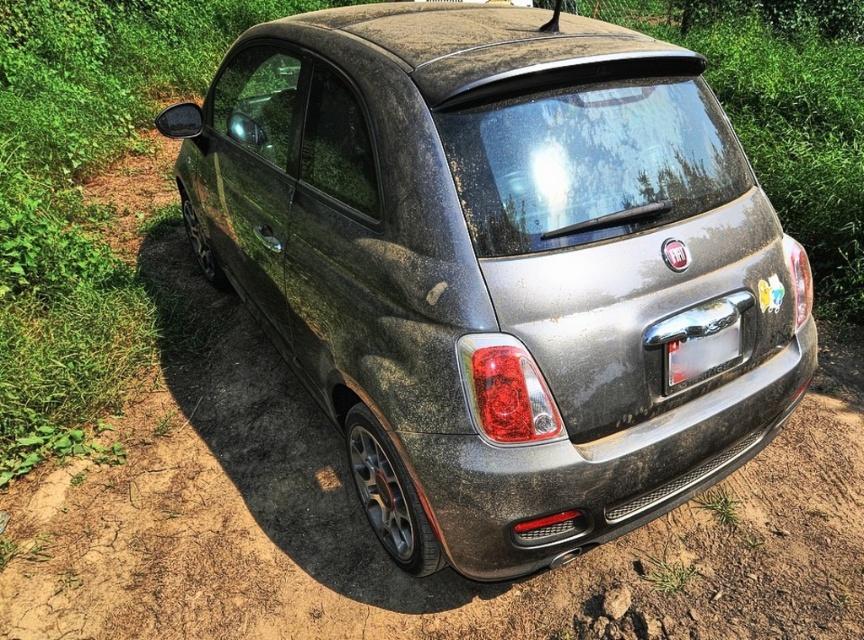
You are a delivery person trying to deliver a package to the address displayed on the license plate of the dusty metallic car at center. However, you notice the transparent plastic license plate at center is partially obscured. Based on the scene, can you determine if the license plate is visible enough to read the address?

The dusty metallic car at center is in front of the transparent plastic license plate at center, so the license plate is likely blocked by the car and not visible enough to read the address.

You are a delivery person trying to read the license plate of the dusty metallic car at center. Since the transparent plastic license plate at center is partially obstructed, can you determine which side of the car the license plate is located on?

The transparent plastic license plate at center is located to the right side of the dusty metallic car at center, so the license plate is on the right side of the car.

Looking at this image, you are a delivery robot with a height of 36 inches. You need to deliver a package to the transparent plastic license plate at center on the dusty metallic car at center. Can you reach the license plate without exceeding your maximum height?

The distance between the dusty metallic car at center and the transparent plastic license plate at center is 36.25 inches. Since the robot is 36 inches tall, it can just barely reach the license plate as the distance is slightly taller than the robot.